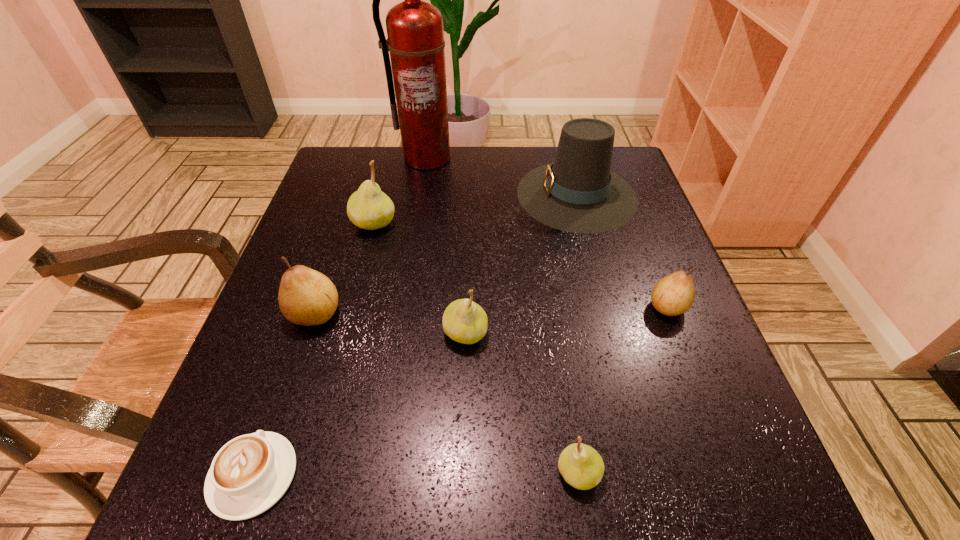
The height and width of the screenshot is (540, 960). I want to click on the nearest green pear, so click(x=581, y=466).

You are a GUI agent. You are given a task and a screenshot of the screen. Output one action in this format:
    pyautogui.click(x=<x>, y=<y>)
    Task: Click on the rightmost green pear
    
    Given the screenshot: What is the action you would take?
    pyautogui.click(x=581, y=466)

You are a GUI agent. You are given a task and a screenshot of the screen. Output one action in this format:
    pyautogui.click(x=<x>, y=<y>)
    Task: Click on the shortest object
    
    Given the screenshot: What is the action you would take?
    pyautogui.click(x=249, y=474)

You are a GUI agent. You are given a task and a screenshot of the screen. Output one action in this format:
    pyautogui.click(x=<x>, y=<y>)
    Task: Click on the free space located on the side of the tallest object with the handle and hose
    This screenshot has height=540, width=960.
    Given the screenshot: What is the action you would take?
    pyautogui.click(x=415, y=227)

The width and height of the screenshot is (960, 540). What are the coordinates of `free space located on the front-facing side of the hat` in the screenshot? It's located at (436, 194).

Image resolution: width=960 pixels, height=540 pixels. Find the location of `vacant region located on the front-facing side of the hat`. vacant region located on the front-facing side of the hat is located at coordinates (392, 194).

Where is `vacant space positioned 0.220m on the front-facing side of the hat`? The height and width of the screenshot is (540, 960). vacant space positioned 0.220m on the front-facing side of the hat is located at coordinates (428, 194).

Image resolution: width=960 pixels, height=540 pixels. Find the location of `free region located on the right of the farthest pear`. free region located on the right of the farthest pear is located at coordinates (519, 223).

At what (x,y) coordinates should I click in order to perform the action: click on free location located 0.170m on the back of the bigger brown pear. Please return your answer as a coordinate pair (x, y). Looking at the image, I should click on (341, 237).

The height and width of the screenshot is (540, 960). I want to click on free spot located on the right of the third pear from right to left, so pyautogui.click(x=677, y=333).